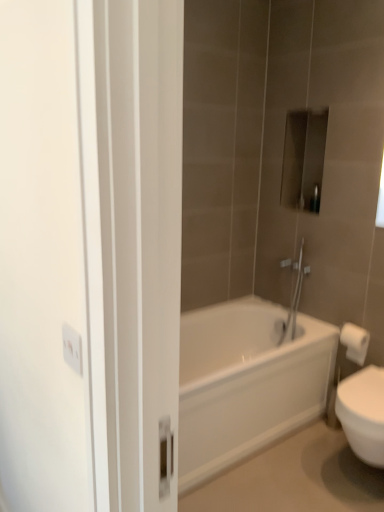
Question: Is point (367, 338) positioned closer to the camera than point (279, 384)?

Choices:
 (A) farther
 (B) closer

Answer: (A)

Question: In terms of width, does white paper towel at right look wider or thinner when compared to white glossy bathtub at center?

Choices:
 (A) wide
 (B) thin

Answer: (B)

Question: Based on their relative distances, which object is nearer to the white glossy bathtub at center?

Choices:
 (A) white paper towel at right
 (B) metallic rectangular object at upper center

Answer: (A)

Question: Considering the real-world distances, which object is farthest from the metallic rectangular object at upper center?

Choices:
 (A) white glossy bathtub at center
 (B) white paper towel at right

Answer: (A)